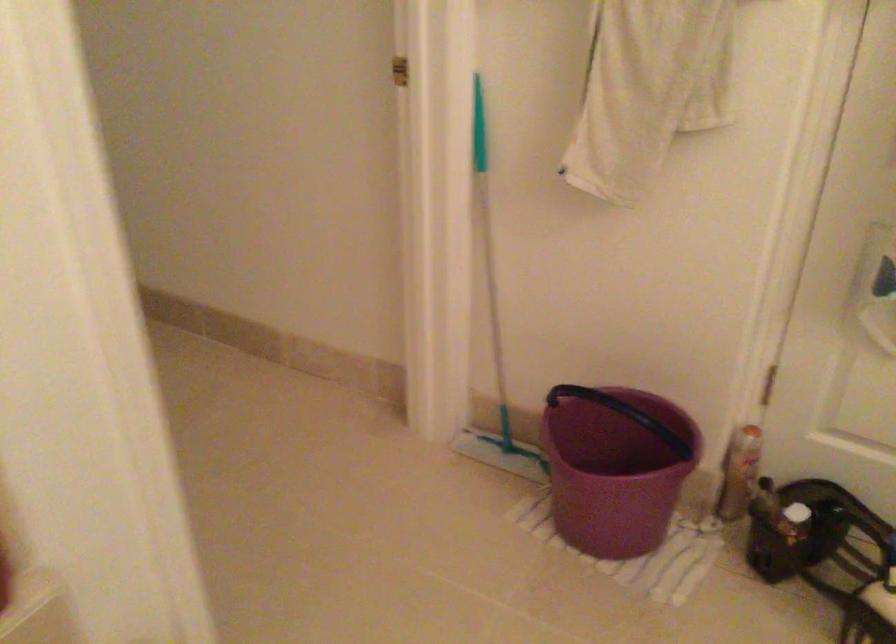
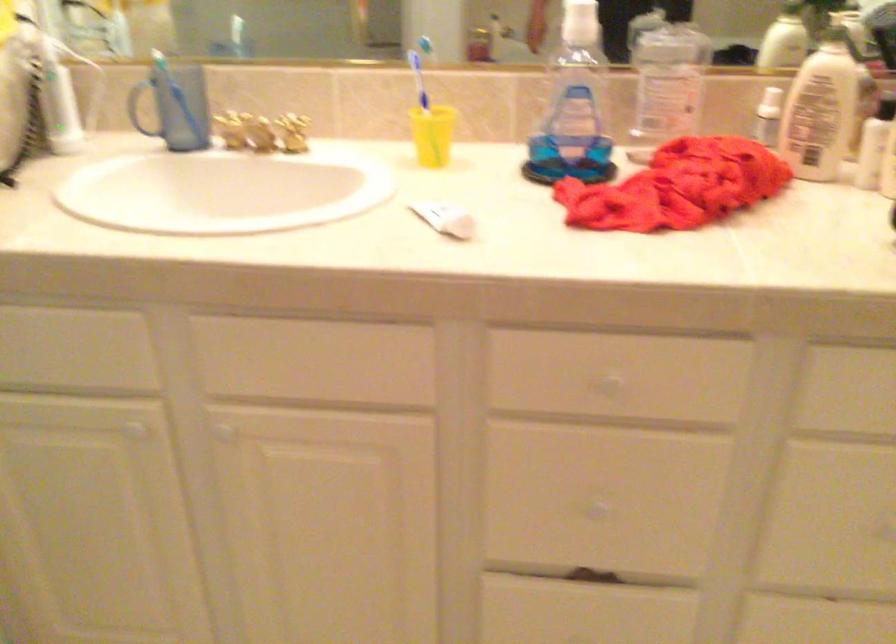
The images are taken continuously from a first-person perspective. In which direction is your viewpoint rotating?

The rotation direction of the camera is right-down.